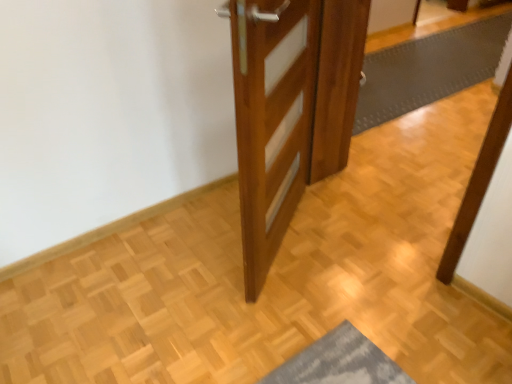
The width and height of the screenshot is (512, 384). Find the location of `vacant point to the right of wooden door at center`. vacant point to the right of wooden door at center is located at coordinates (349, 251).